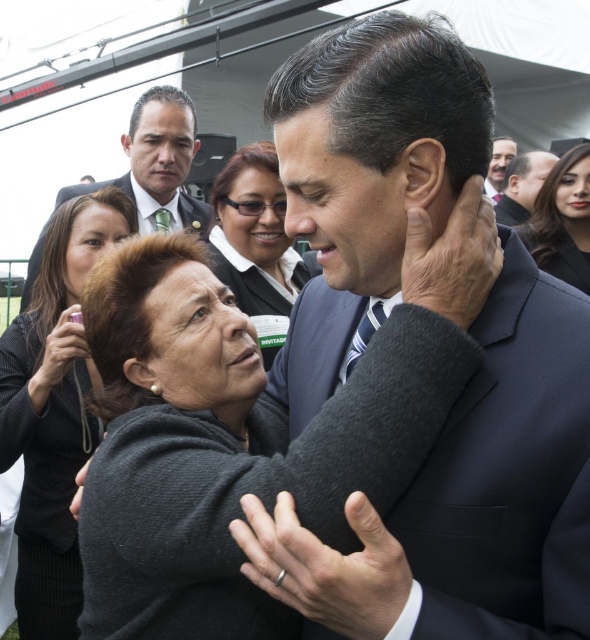
Question: Which point is closer to the camera taking this photo?

Choices:
 (A) (280, 189)
 (B) (517, 177)

Answer: (A)

Question: Does dark gray sweater at lower left have a lesser width compared to smooth brown hair at upper right?

Choices:
 (A) yes
 (B) no

Answer: (B)

Question: Is dark blue suit at center positioned at the back of smooth brown hair at upper right?

Choices:
 (A) no
 (B) yes

Answer: (A)

Question: Which object appears farthest from the camera in this image?

Choices:
 (A) smooth black suit at upper right
 (B) matte black suit at center
 (C) dark gray sweater at lower left

Answer: (A)

Question: Can you confirm if matte black suit at upper center is bigger than smooth black hair at upper right?

Choices:
 (A) no
 (B) yes

Answer: (B)

Question: Which of the following is the farthest from the observer?

Choices:
 (A) (414, 138)
 (B) (520, 220)
 (C) (573, 188)
 (D) (172, 221)

Answer: (B)